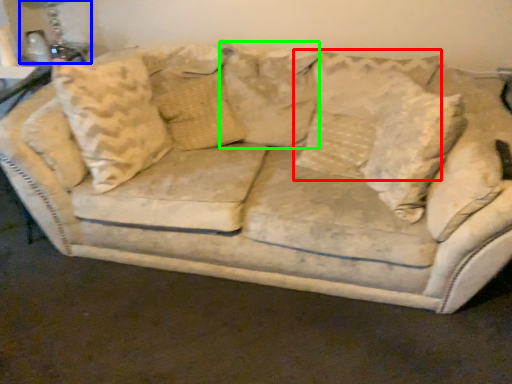
Question: Which object is the closest to the pillow (highlighted by a red box)? Choose among these: table lamp (highlighted by a blue box) or pillow (highlighted by a green box).

Choices:
 (A) table lamp
 (B) pillow

Answer: (B)